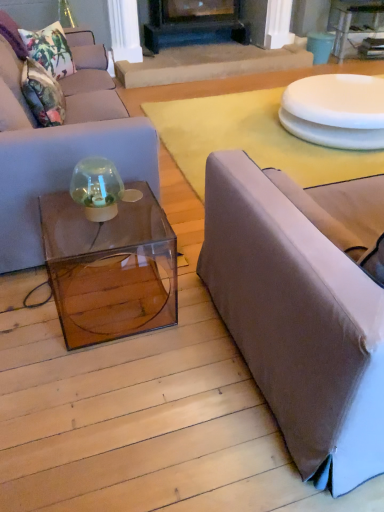
Question: Considering the positions of point (342, 50) and point (89, 125), is point (342, 50) closer or farther from the camera than point (89, 125)?

Choices:
 (A) closer
 (B) farther

Answer: (B)

Question: Is transparent glass table at upper right bigger or smaller than matte gray couch at left, positioned as the 1th studio couch in left-to-right order?

Choices:
 (A) big
 (B) small

Answer: (B)

Question: Estimate the real-world distances between objects in this image. Which object is closer to the matte gray couch at left, positioned as the 1th studio couch in left-to-right order?

Choices:
 (A) floral fabric cushion at upper left, marked as the first pillow in a bottom-to-top arrangement
 (B) transparent glass table at upper right
 (C) white glossy plate at upper right
 (D) black matte fireplace at center
 (E) brown fabric studio couch at right, arranged as the 1th studio couch when viewed from the right

Answer: (A)

Question: Which of these objects is positioned farthest from the floral fabric cushion at upper left, which is counted as the second pillow, starting from the top?

Choices:
 (A) floral fabric pillow at upper left, positioned as the 2th pillow in bottom-to-top order
 (B) transparent glass table at upper right
 (C) white glossy plate at upper right
 (D) black matte fireplace at center
 (E) white glossy plate at upper right

Answer: (B)